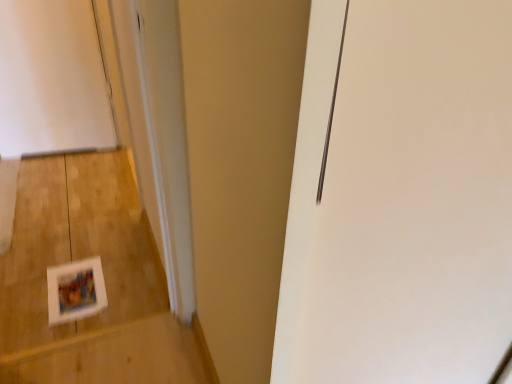
Question: Is matte white postcard at lower left far away from white matte frame at lower left?

Choices:
 (A) yes
 (B) no

Answer: (B)

Question: From a real-world perspective, is matte white postcard at lower left positioned over white matte frame at lower left based on gravity?

Choices:
 (A) no
 (B) yes

Answer: (B)

Question: Does matte white postcard at lower left appear on the right side of white matte frame at lower left?

Choices:
 (A) yes
 (B) no

Answer: (A)

Question: Considering the relative sizes of matte white postcard at lower left and white matte frame at lower left in the image provided, is matte white postcard at lower left shorter than white matte frame at lower left?

Choices:
 (A) no
 (B) yes

Answer: (B)

Question: Does matte white postcard at lower left come behind white matte frame at lower left?

Choices:
 (A) no
 (B) yes

Answer: (B)

Question: Can you confirm if matte white postcard at lower left is bigger than white matte frame at lower left?

Choices:
 (A) yes
 (B) no

Answer: (B)

Question: Considering the relative sizes of white matte frame at lower left and matte white postcard at lower left in the image provided, is white matte frame at lower left thinner than matte white postcard at lower left?

Choices:
 (A) yes
 (B) no

Answer: (B)

Question: Considering the relative sizes of white matte frame at lower left and matte white postcard at lower left in the image provided, is white matte frame at lower left bigger than matte white postcard at lower left?

Choices:
 (A) no
 (B) yes

Answer: (B)

Question: Does white matte frame at lower left have a greater width compared to matte white postcard at lower left?

Choices:
 (A) yes
 (B) no

Answer: (A)

Question: From a real-world perspective, is white matte frame at lower left under matte white postcard at lower left?

Choices:
 (A) no
 (B) yes

Answer: (B)

Question: From a real-world perspective, does white matte frame at lower left stand above matte white postcard at lower left?

Choices:
 (A) no
 (B) yes

Answer: (A)

Question: Is white matte frame at lower left placed right next to matte white postcard at lower left?

Choices:
 (A) yes
 (B) no

Answer: (B)

Question: Considering the positions of point (44, 304) and point (62, 317), is point (44, 304) closer or farther from the camera than point (62, 317)?

Choices:
 (A) closer
 (B) farther

Answer: (B)